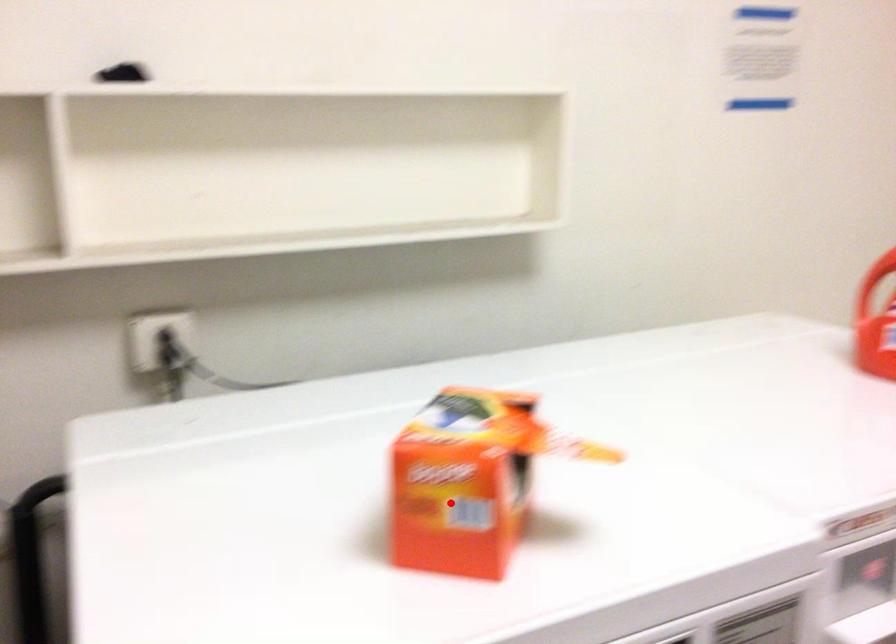
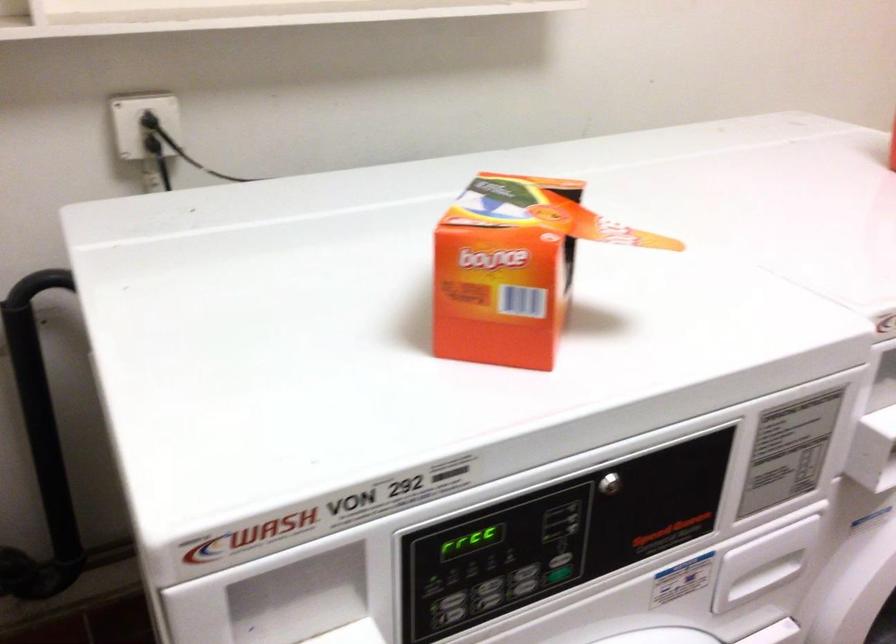
The point at the highlighted location is marked in the first image. Where is the corresponding point in the second image?

(502, 287)